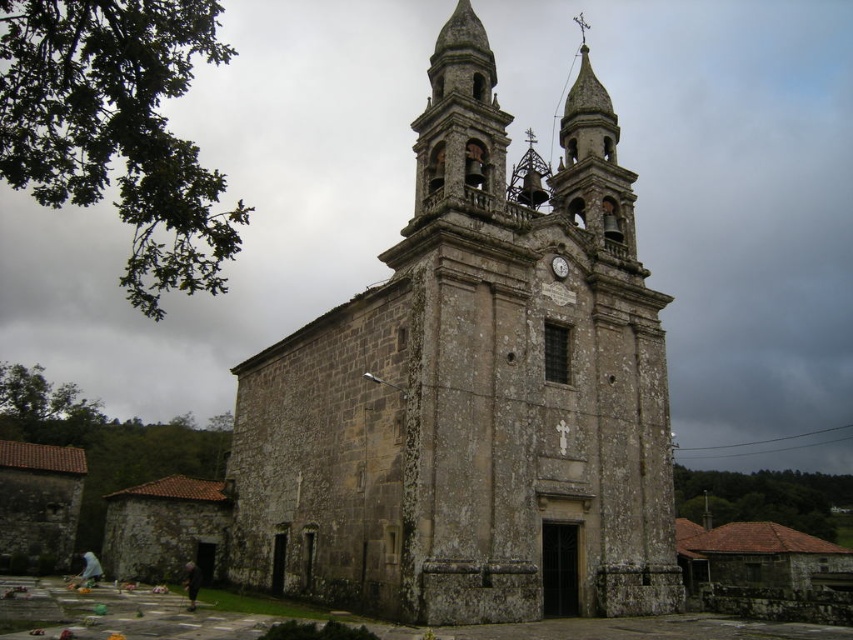
Where is `stone bell tower at center`? This screenshot has height=640, width=853. stone bell tower at center is located at coordinates (459, 116).

Who is positioned more to the left, stone bell tower at center or metallic clock at center?

From the viewer's perspective, stone bell tower at center appears more on the left side.

You are a GUI agent. You are given a task and a screenshot of the screen. Output one action in this format:
    pyautogui.click(x=<x>, y=<y>)
    Task: Click on the stone bell tower at center
    
    Given the screenshot: What is the action you would take?
    pyautogui.click(x=459, y=116)

Identify the location of stone bell tower at center. This screenshot has width=853, height=640. (459, 116).

Based on the photo, can you confirm if polished bronze bell at upper center is thinner than metallic clock at center?

Incorrect, polished bronze bell at upper center's width is not less than metallic clock at center's.

Does polished bronze bell at upper center have a smaller size compared to metallic clock at center?

Incorrect, polished bronze bell at upper center is not smaller in size than metallic clock at center.

I want to click on polished bronze bell at upper center, so click(x=529, y=177).

You are a GUI agent. You are given a task and a screenshot of the screen. Output one action in this format:
    pyautogui.click(x=<x>, y=<y>)
    Task: Click on the polished bronze bell at upper center
    This screenshot has width=853, height=640.
    Given the screenshot: What is the action you would take?
    pyautogui.click(x=529, y=177)

Who is more distant from viewer, (483, 61) or (524, 179)?

Point (524, 179)

Does point (468, 170) come farther from viewer compared to point (515, 170)?

No, it is in front of (515, 170).

Is point (442, 112) positioned behind point (526, 163)?

No, it is in front of (526, 163).

You are a GUI agent. You are given a task and a screenshot of the screen. Output one action in this format:
    pyautogui.click(x=<x>, y=<y>)
    Task: Click on the stone bell tower at center
    The image size is (853, 640).
    Given the screenshot: What is the action you would take?
    pyautogui.click(x=459, y=116)